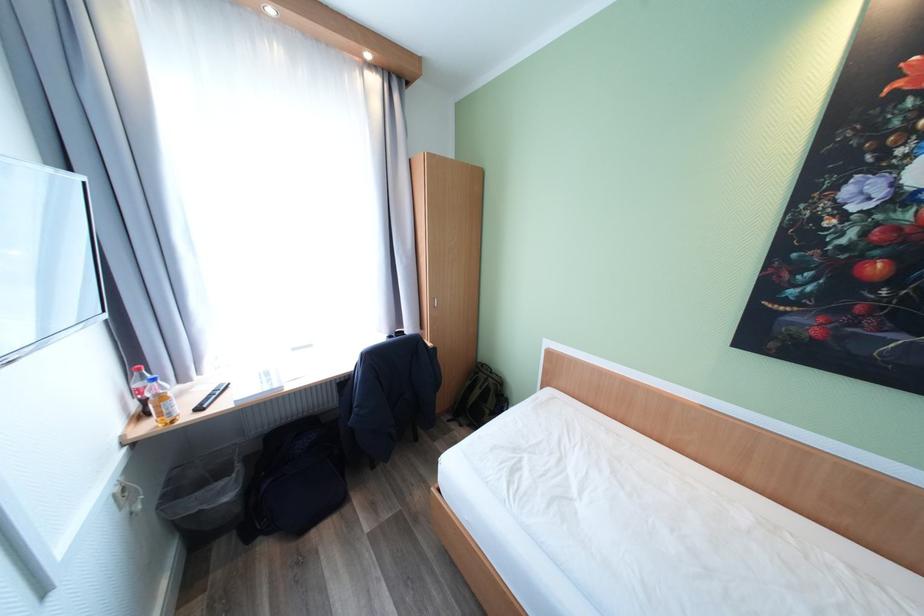
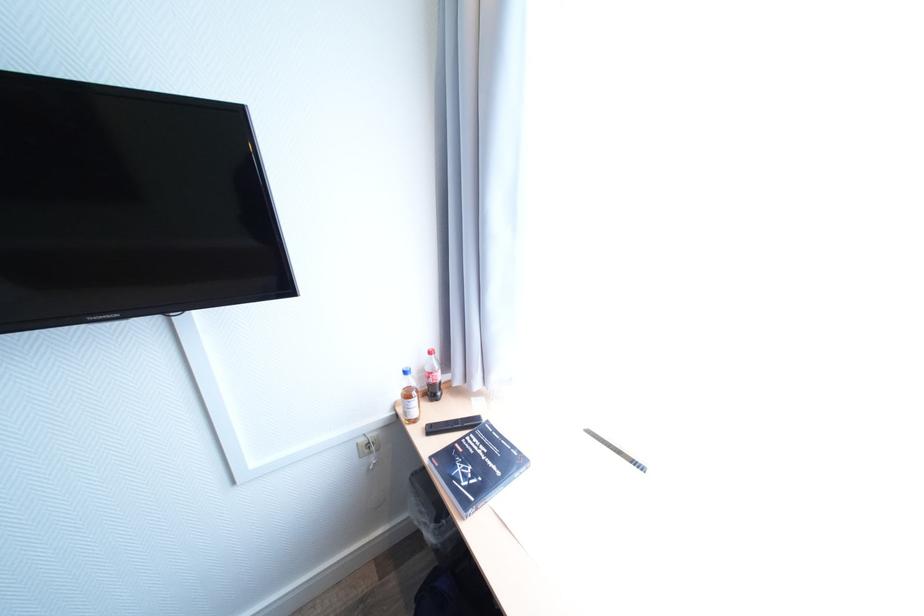
The point at (x=129, y=438) is marked in the first image. Where is the corresponding point in the second image?

(403, 403)